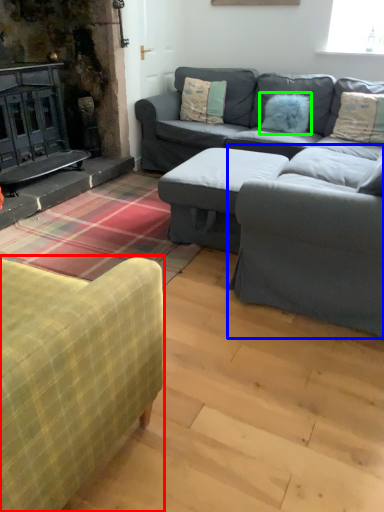
Question: Which object is positioned closest to studio couch (highlighted by a red box)? Select from armchair (highlighted by a blue box) and pillow (highlighted by a green box).

Choices:
 (A) armchair
 (B) pillow

Answer: (A)